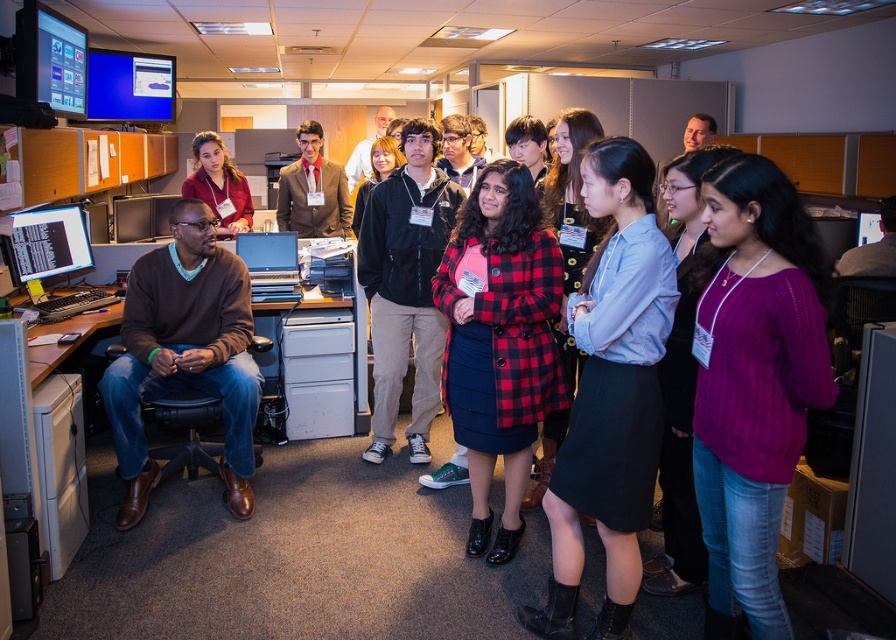
You are organizing a meeting in this office and need to place a 12x12 inch square box on the desk. The brown sweater at left and the matte black laptop at center are already on the desk. Which object takes up more space on the desk?

The brown sweater at left has a larger size compared to the matte black laptop at center, so it occupies more space on the desk.

In the scene shown: You are an office worker who needs to locate your matte black laptop at center. You see a brown sweater at left nearby. Which direction should you move to reach your laptop?

The brown sweater at left is to the left of the matte black laptop at center, so you should move to the right to reach your matte black laptop at center.